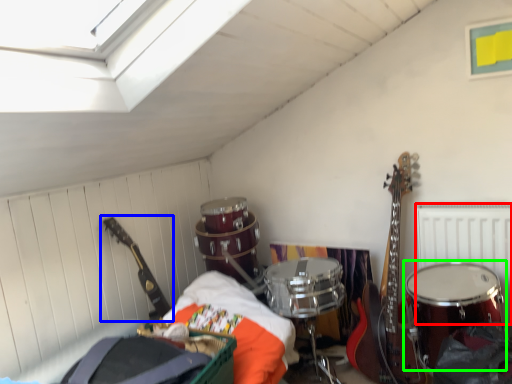
Question: Considering the real-world distances, which object is closest to radiator (highlighted by a red box)? guitar (highlighted by a blue box) or drum (highlighted by a green box).

Choices:
 (A) guitar
 (B) drum

Answer: (B)